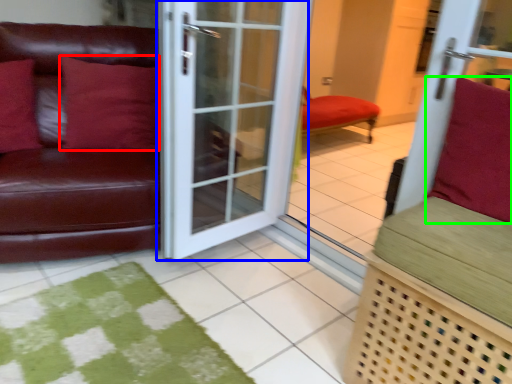
Question: Based on their relative distances, which object is nearer to pillow (highlighted by a red box)? Choose from door (highlighted by a blue box) and pillow (highlighted by a green box).

Choices:
 (A) door
 (B) pillow

Answer: (A)